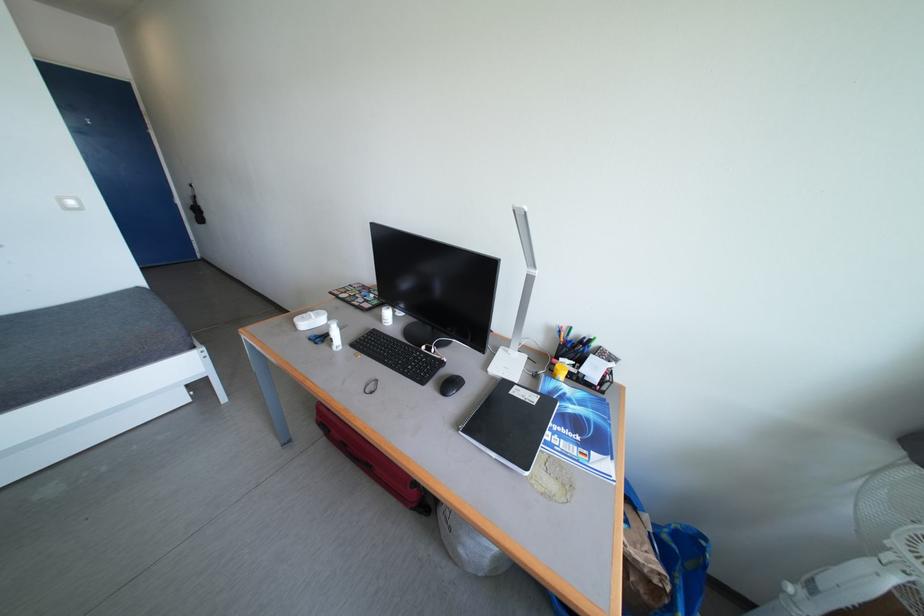
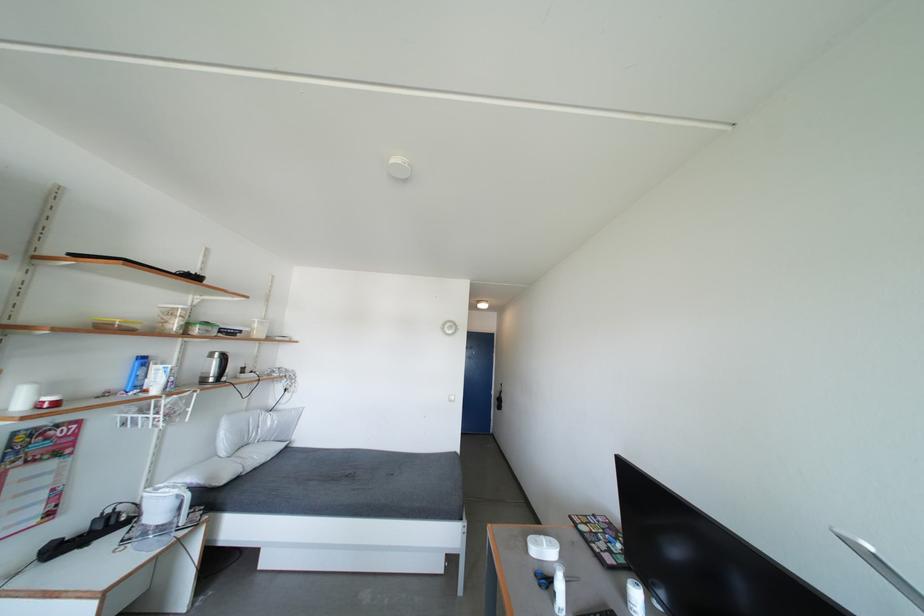
Locate, in the second image, the point that corresponds to the point at 317,318 in the first image.

(550, 544)